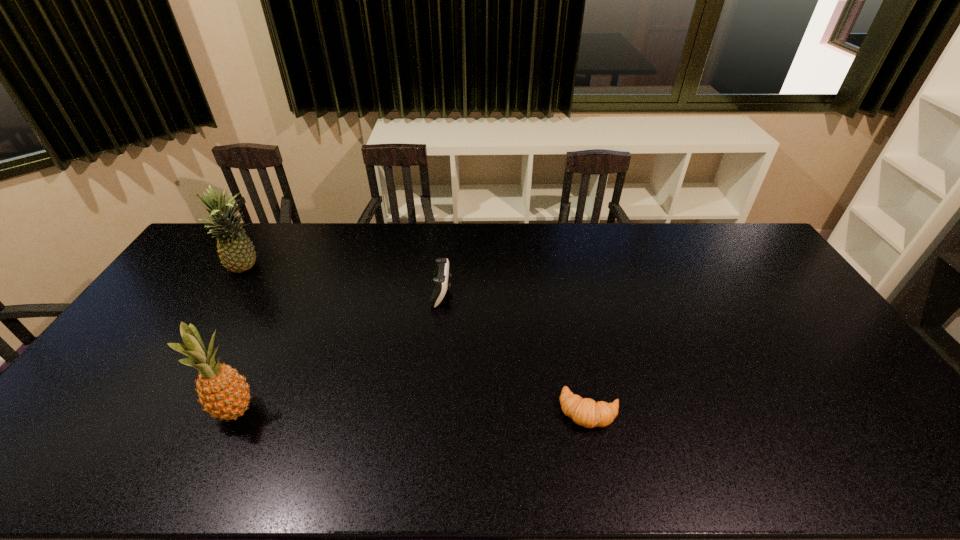
At what (x,y) coordinates should I click in order to perform the action: click on the leftmost object. Please return your answer as a coordinate pair (x, y). Looking at the image, I should click on pos(236,251).

Locate an element on the screen. This screenshot has height=540, width=960. the left pineapple is located at coordinates (236, 251).

The height and width of the screenshot is (540, 960). I want to click on the second object from left to right, so click(x=223, y=393).

What are the coordinates of `the nearer pineapple` in the screenshot? It's located at (223, 393).

Locate an element on the screen. The height and width of the screenshot is (540, 960). control is located at coordinates (441, 274).

Where is `the third object from left to right`? Image resolution: width=960 pixels, height=540 pixels. the third object from left to right is located at coordinates (441, 274).

This screenshot has width=960, height=540. In order to click on the rightmost object in this screenshot , I will do `click(586, 412)`.

I want to click on crescent roll, so click(x=586, y=412).

The image size is (960, 540). Find the location of `vacant space located on the back of the left pineapple`. vacant space located on the back of the left pineapple is located at coordinates (271, 228).

Where is `free spot located on the right of the third object from right to left`? free spot located on the right of the third object from right to left is located at coordinates (344, 410).